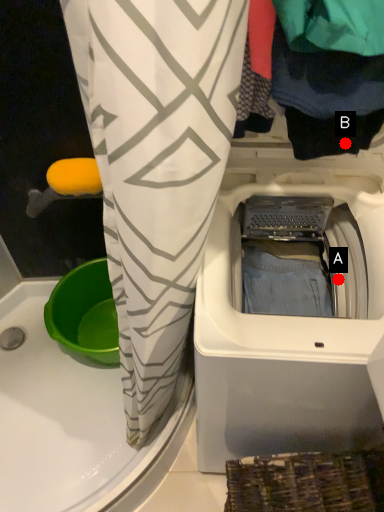
Question: Two points are circled on the image, labeled by A and B beside each circle. Which point appears farthest from the camera in this image?

Choices:
 (A) A is further
 (B) B is further

Answer: (A)